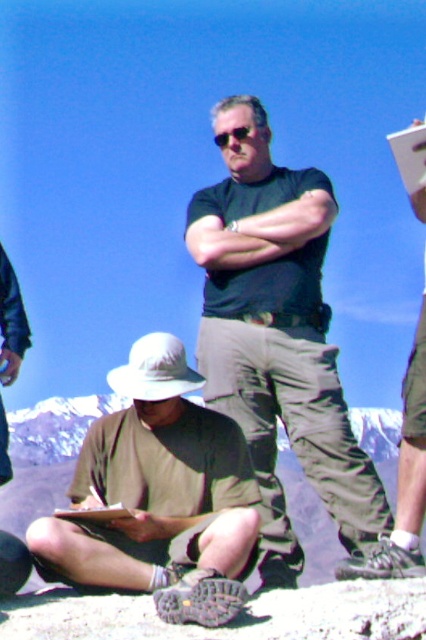
Question: Among these objects, which one is farthest from the camera?

Choices:
 (A) tan fabric hat at lower left
 (B) reflective plastic sunglasses at center
 (C) black matte shirt at center
 (D) white paper at upper right

Answer: (B)

Question: Among these points, which one is nearest to the camera?

Choices:
 (A) (199, 378)
 (B) (238, 128)

Answer: (A)

Question: Does black matte shirt at center appear under matte black shirt at center?

Choices:
 (A) no
 (B) yes

Answer: (A)

Question: Which point is farther from the camera taking this photo?

Choices:
 (A) (77, 508)
 (B) (184, 500)
 (C) (216, 140)
 (D) (425, 365)

Answer: (C)

Question: Can you confirm if white paper at upper right is wider than wooden clipboard at lower left?

Choices:
 (A) yes
 (B) no

Answer: (A)

Question: Can you confirm if black matte shirt at center is positioned above white paper at upper right?

Choices:
 (A) no
 (B) yes

Answer: (A)